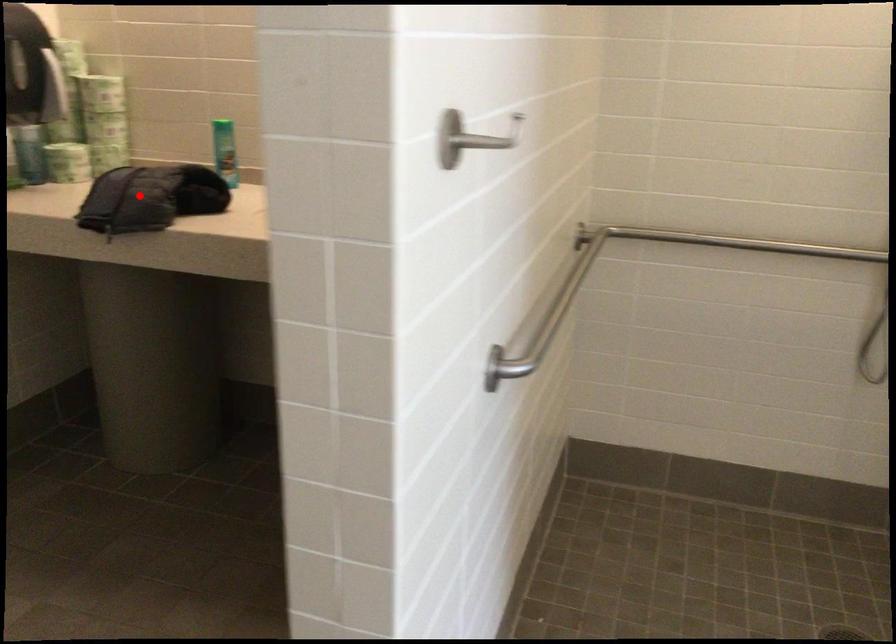
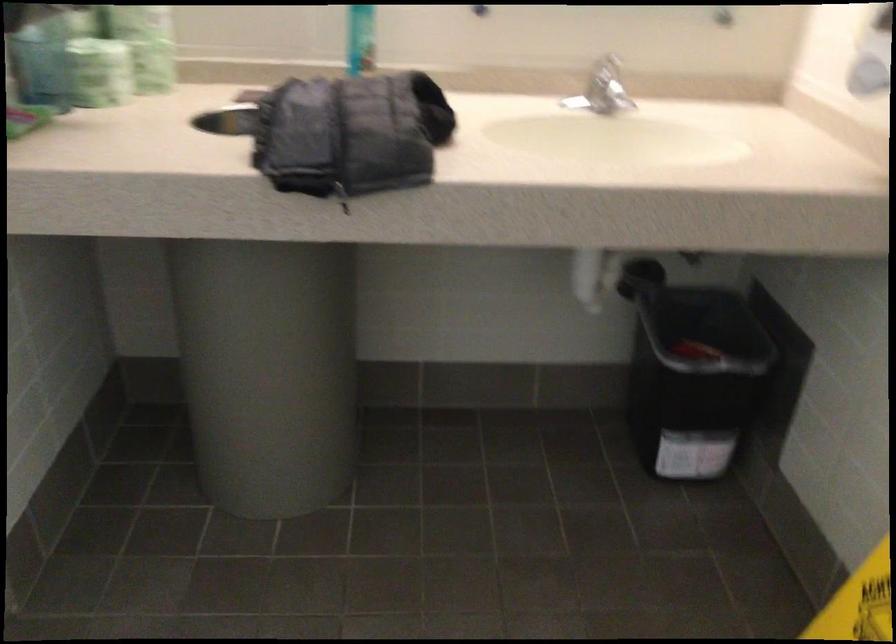
Question: I am providing you with two images of the same scene from different viewpoints. Image1 has a red point marked. In image2, the corresponding 3D location appears at what relative position? Reply with the corresponding letter.

Choices:
 (A) Closer
 (B) Farther

Answer: (A)